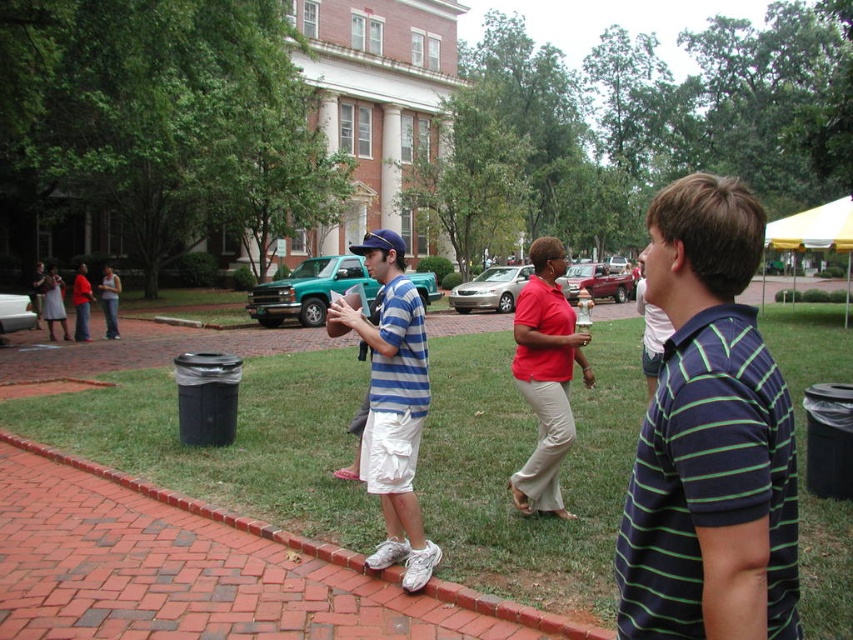
Measure the distance between striped polo shirt at center and camera.

striped polo shirt at center and camera are 1.80 meters apart from each other.

Does striped polo shirt at center have a smaller size compared to blue fabric baseball cap at center?

Incorrect, striped polo shirt at center is not smaller in size than blue fabric baseball cap at center.

Between point (648, 326) and point (366, 237), which one is positioned behind?

Positioned behind is point (366, 237).

Where is `striped polo shirt at center`? The width and height of the screenshot is (853, 640). striped polo shirt at center is located at coordinates (650, 330).

Between dark blue striped polo shirt at center and striped cotton shirt at center, which one appears on the left side from the viewer's perspective?

Positioned to the left is striped cotton shirt at center.

Does dark blue striped polo shirt at center have a lesser width compared to striped cotton shirt at center?

No.

Which is behind, point (792, 492) or point (392, 396)?

The point (392, 396) is more distant.

The width and height of the screenshot is (853, 640). I want to click on dark blue striped polo shirt at center, so click(709, 440).

Does dark blue striped polo shirt at center appear on the right side of striped polo shirt at center?

Incorrect, dark blue striped polo shirt at center is not on the right side of striped polo shirt at center.

Is point (700, 472) farther from camera compared to point (639, 300)?

No, (700, 472) is in front of (639, 300).

Identify the location of dark blue striped polo shirt at center. (709, 440).

Find the location of `dark blue striped polo shirt at center`. dark blue striped polo shirt at center is located at coordinates (709, 440).